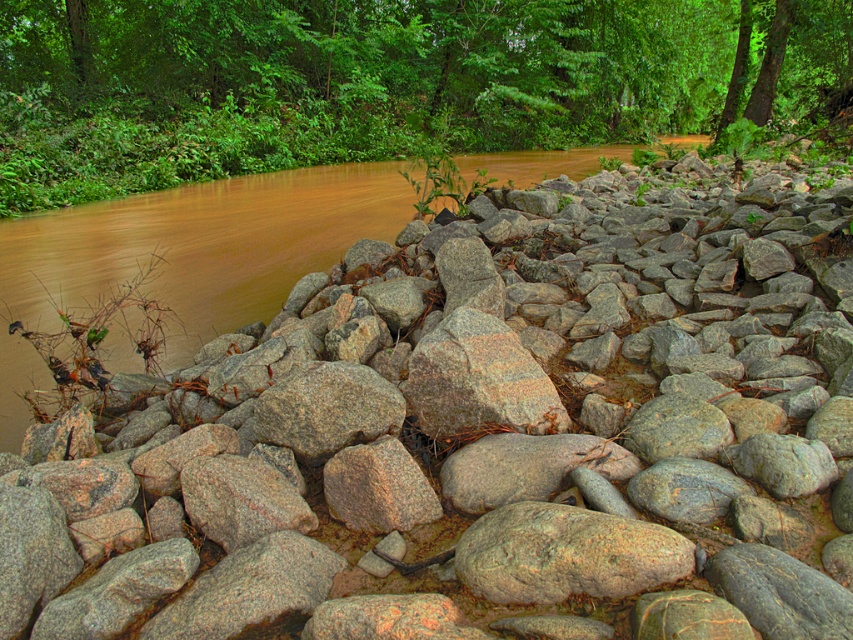
How far apart are green leafy tree at upper center and granite rock at center?

They are 18.60 meters apart.

Does green leafy tree at upper center have a larger size compared to granite rock at center?

Yes, green leafy tree at upper center is bigger than granite rock at center.

What do you see at coordinates (343, 83) in the screenshot? This screenshot has width=853, height=640. I see `green leafy tree at upper center` at bounding box center [343, 83].

Identify the location of green leafy tree at upper center. (343, 83).